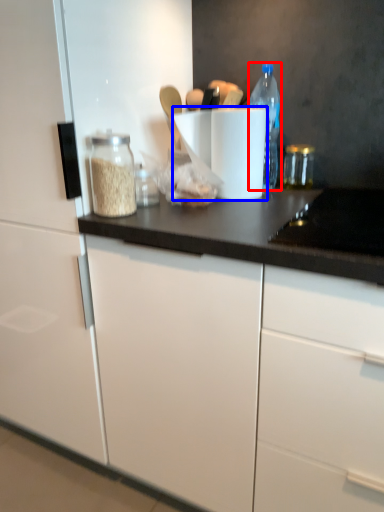
Question: Which object is closer to the camera taking this photo, bottle (highlighted by a red box) or paper towel (highlighted by a blue box)?

Choices:
 (A) bottle
 (B) paper towel

Answer: (B)